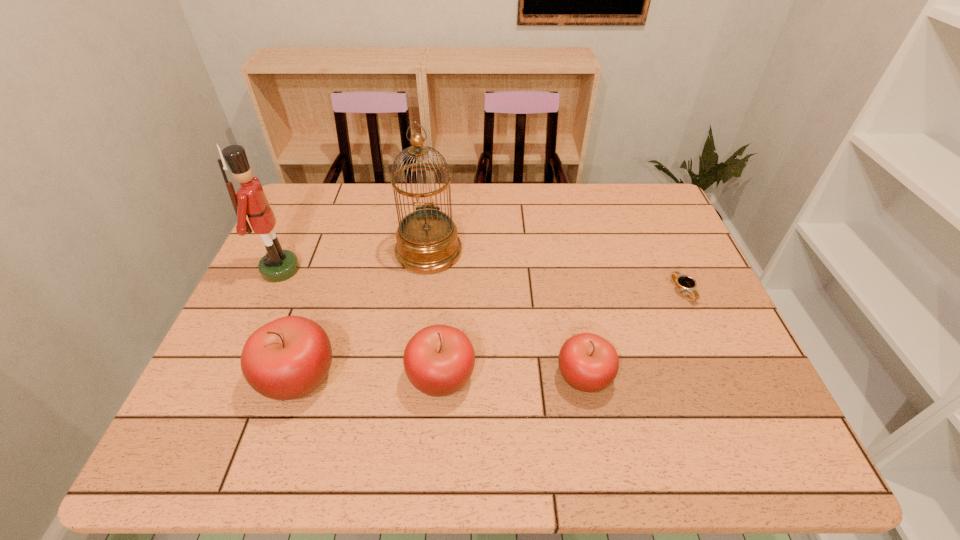
Locate an element on the screen. vacant area between the leftmost object and the birdcage is located at coordinates (355, 260).

This screenshot has width=960, height=540. Find the location of `free area in between the leftmost apple and the second apple from right to left`. free area in between the leftmost apple and the second apple from right to left is located at coordinates (370, 377).

Identify the location of vacant space that is in between the rightmost apple and the second tallest apple. (513, 377).

I want to click on free area in between the nutcracker and the shortest apple, so click(x=432, y=323).

I want to click on vacant point located between the shortest apple and the second shortest apple, so click(x=513, y=377).

Locate which object ranks second in proximity to the leftmost apple. Please provide its 2D coordinates. Your answer should be formatted as a tuple, i.e. [(x, y)], where the tuple contains the x and y coordinates of a point satisfying the conditions above.

[(277, 265)]

Where is `object that stands as the closest to the shortest apple`? The width and height of the screenshot is (960, 540). object that stands as the closest to the shortest apple is located at coordinates (439, 360).

Locate an element on the screen. This screenshot has height=540, width=960. apple that is the closest to the second tallest apple is located at coordinates (288, 358).

Image resolution: width=960 pixels, height=540 pixels. I want to click on apple that is the second nearest to the third shortest object, so click(589, 363).

This screenshot has height=540, width=960. What are the coordinates of `vacant region that satisfies the following two spatial constraints: 1. with an open door on the birdcage; 2. on the front-facing side of the nutcracker` in the screenshot? It's located at (426, 269).